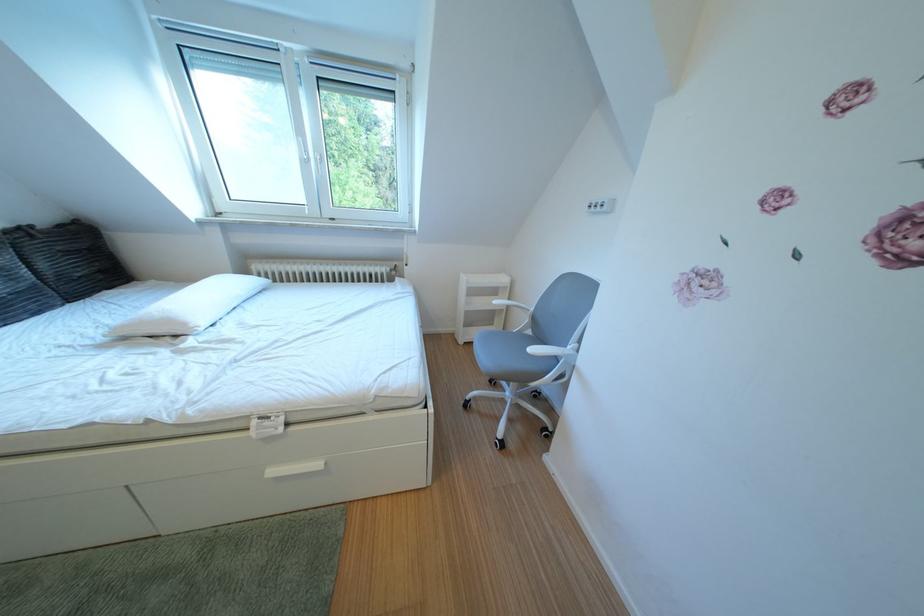
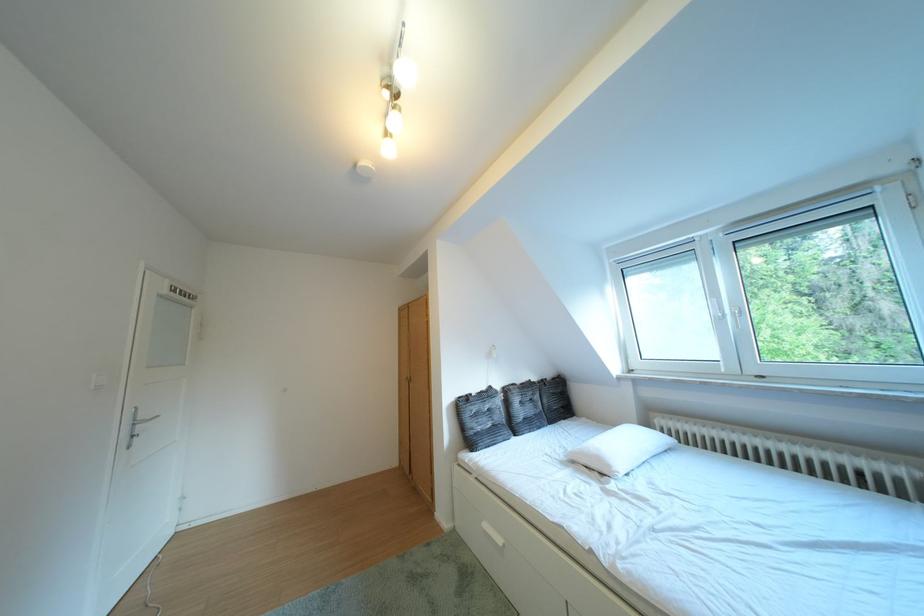
Locate, in the second image, the point that corresponds to point (321, 156) in the first image.

(736, 315)